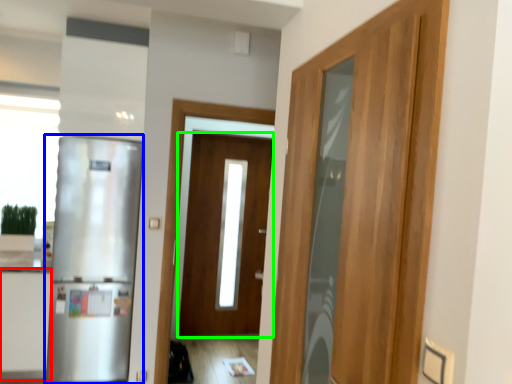
Question: Which is nearer to the cabinetry (highlighted by a red box)? refrigerator (highlighted by a blue box) or door (highlighted by a green box).

Choices:
 (A) refrigerator
 (B) door

Answer: (A)